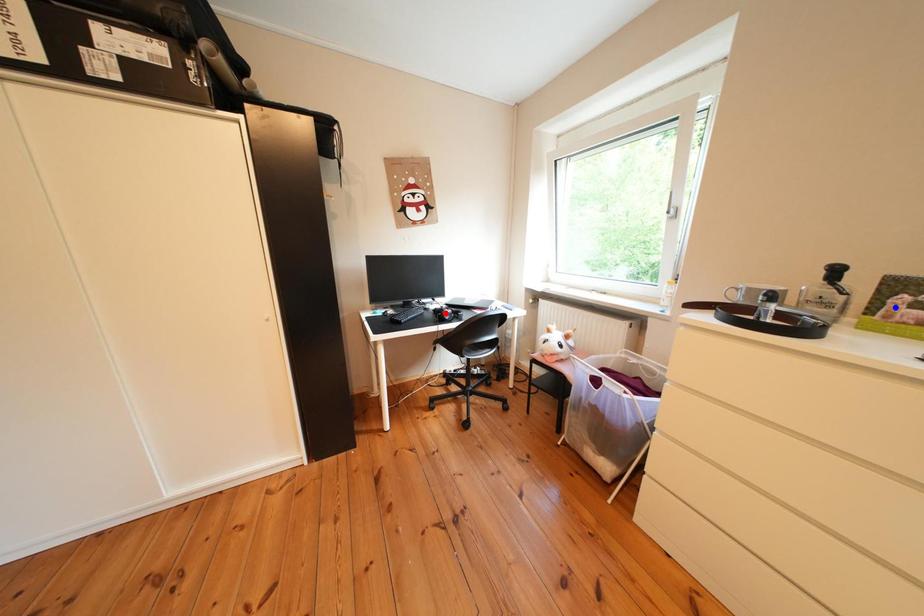
Question: Two points are marked on the image. Which point is closer to the camera?

Choices:
 (A) Blue point is closer.
 (B) Red point is closer.

Answer: (A)